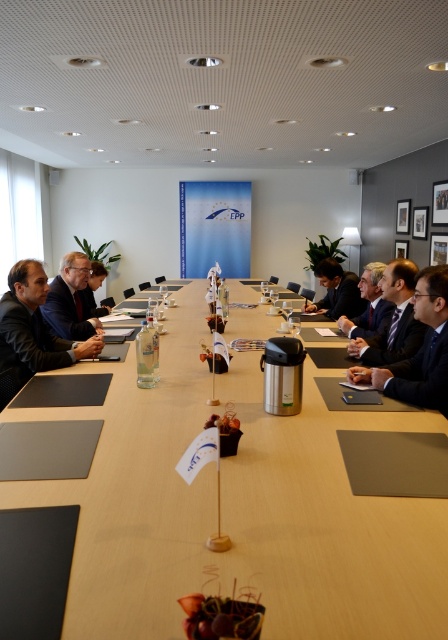
Question: From the image, what is the correct spatial relationship of matte black suit at left in relation to matte black suit at center?

Choices:
 (A) left
 (B) right

Answer: (A)

Question: Based on their relative distances, which object is nearer to the dark blue suit at center?

Choices:
 (A) matte black suit at center
 (B) matte black suit at left

Answer: (B)

Question: Among these points, which one is nearest to the camera?

Choices:
 (A) (14, 372)
 (B) (383, 328)
 (C) (77, 256)

Answer: (A)

Question: Which point is closer to the camera taking this photo?

Choices:
 (A) (86, 268)
 (B) (406, 266)

Answer: (B)

Question: Does matte black suit at left appear on the left side of matte black suit at center?

Choices:
 (A) yes
 (B) no

Answer: (A)

Question: Is matte black suit at left thinner than matte black suit at center?

Choices:
 (A) no
 (B) yes

Answer: (A)